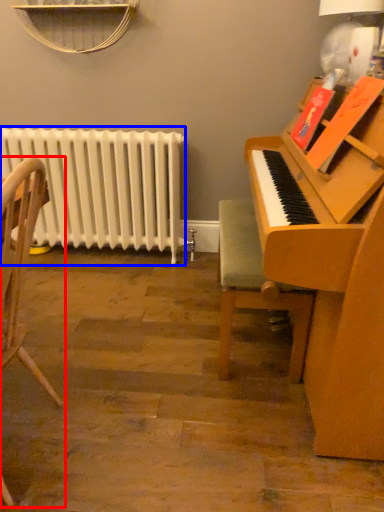
Question: Which point is further to the camera, chair (highlighted by a red box) or radiator (highlighted by a blue box)?

Choices:
 (A) chair
 (B) radiator

Answer: (B)